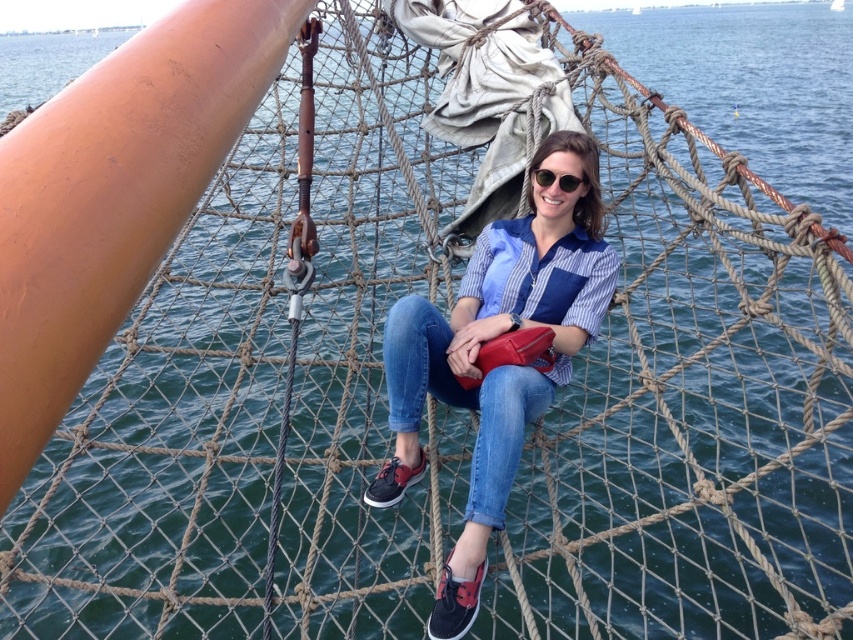
Is blue denim jeans at center smaller than sunglasses at center?

No, blue denim jeans at center is not smaller than sunglasses at center.

This screenshot has height=640, width=853. What do you see at coordinates (498, 365) in the screenshot?
I see `blue denim jeans at center` at bounding box center [498, 365].

Locate an element on the screen. The height and width of the screenshot is (640, 853). blue denim jeans at center is located at coordinates (498, 365).